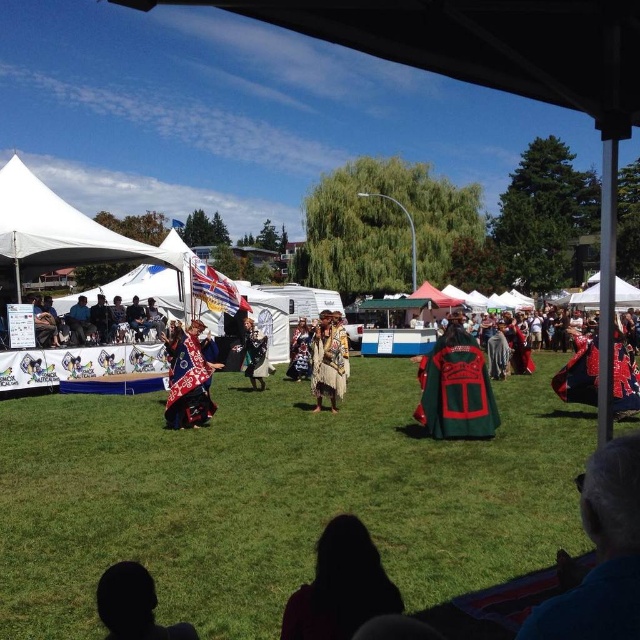
Question: Which object appears farthest from the camera in this image?

Choices:
 (A) green grass at center
 (B) gray fabric at lower right
 (C) patterned fabric dress at center

Answer: (C)

Question: Which is farther from the embroidered velvet cape at center?

Choices:
 (A) silhouette fabric at lower left
 (B) textured brown fur coat at center

Answer: (B)

Question: Does silhouette fabric at lower center lie in front of matte black jacket at left?

Choices:
 (A) no
 (B) yes

Answer: (B)

Question: From the image, what is the correct spatial relationship of silhouette fabric at lower left in relation to velvet red cape at center?

Choices:
 (A) left
 (B) right

Answer: (B)

Question: Can you confirm if embroidered velvet cape at center is positioned to the left of velvet red cape at center?

Choices:
 (A) no
 (B) yes

Answer: (A)

Question: Which object is farther from the camera taking this photo?

Choices:
 (A) patterned fabric dress at center
 (B) green fabric cape at center

Answer: (A)